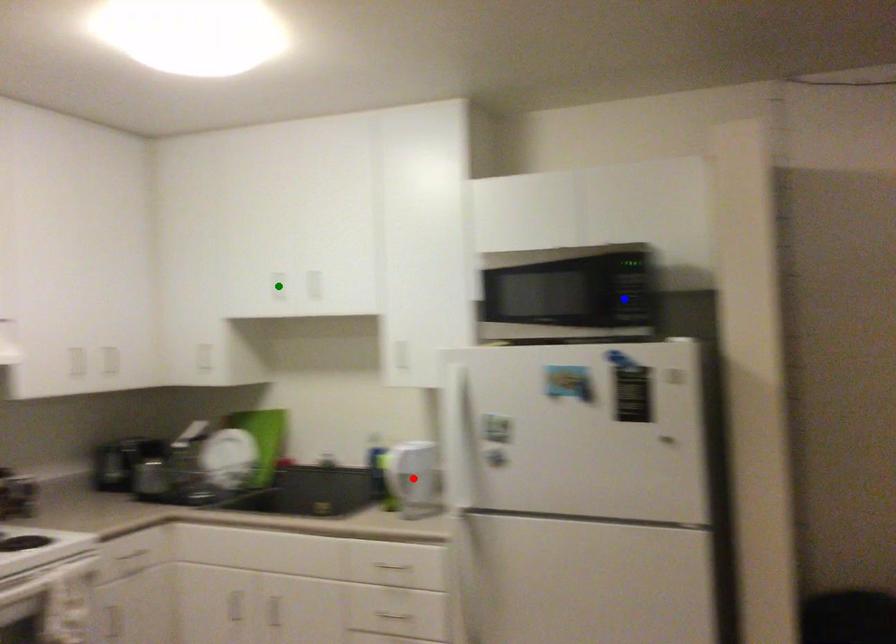
In the scene shown: Order these from farthest to nearest:
- red point
- blue point
- green point

green point, red point, blue point